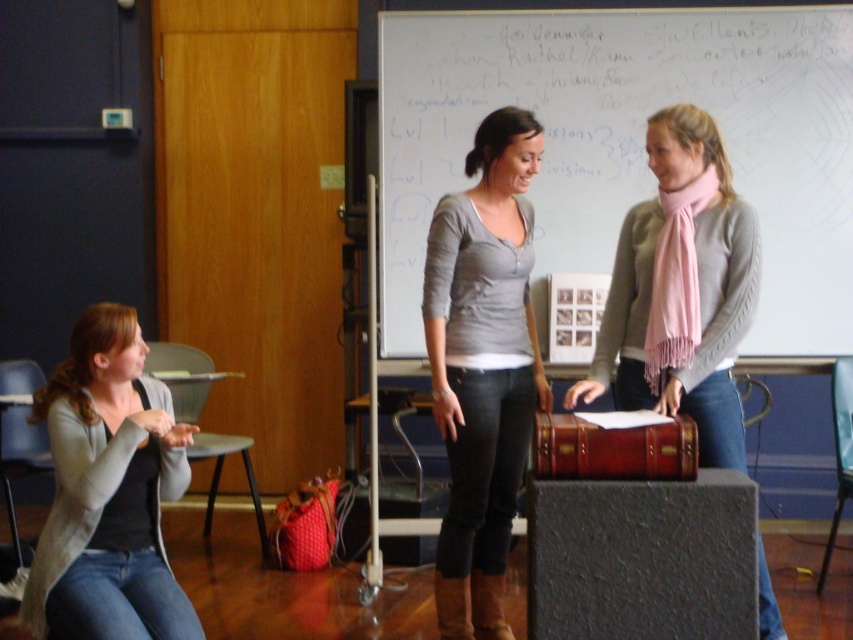
Which of these two, light gray sweater at center or matte gray cardigan at lower left, stands taller?

Standing taller between the two is light gray sweater at center.

Is light gray sweater at center further to the viewer compared to matte gray cardigan at lower left?

Yes, light gray sweater at center is behind matte gray cardigan at lower left.

The image size is (853, 640). What do you see at coordinates (682, 291) in the screenshot?
I see `light gray sweater at center` at bounding box center [682, 291].

At what (x,y) coordinates should I click in order to perform the action: click on light gray sweater at center. Please return your answer as a coordinate pair (x, y). Looking at the image, I should click on (682, 291).

Can you confirm if matte gray shirt at center is thinner than light gray sweater at center?

Indeed, matte gray shirt at center has a lesser width compared to light gray sweater at center.

The width and height of the screenshot is (853, 640). Describe the element at coordinates (482, 365) in the screenshot. I see `matte gray shirt at center` at that location.

Locate an element on the screen. The width and height of the screenshot is (853, 640). matte gray shirt at center is located at coordinates (482, 365).

Is whiteboard at upper center thinner than matte gray shirt at center?

No, whiteboard at upper center is not thinner than matte gray shirt at center.

Consider the image. Can you confirm if whiteboard at upper center is wider than matte gray shirt at center?

Correct, the width of whiteboard at upper center exceeds that of matte gray shirt at center.

Find the location of `whiteboard at upper center`. whiteboard at upper center is located at coordinates (627, 141).